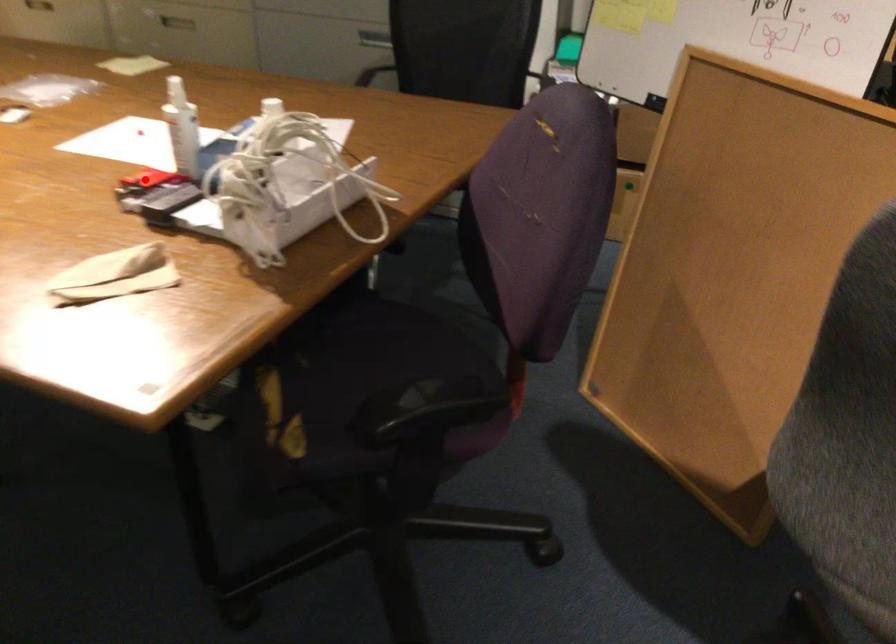
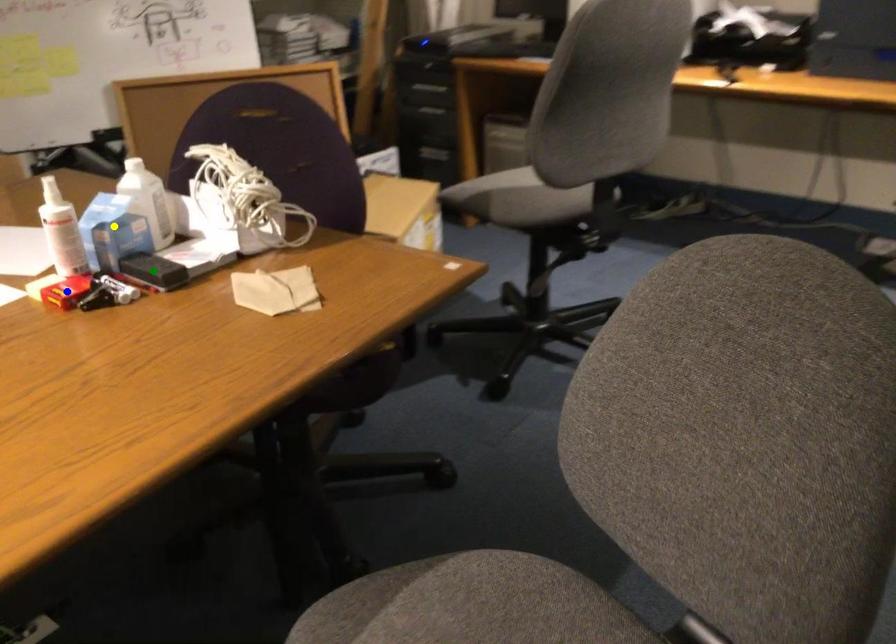
Question: I am providing you with two images of the same scene from different viewpoints. A red point is marked on the first image. You are given multiple points on the second image. In image 2, which mark is for the same physical point as the one in image 1?

Choices:
 (A) blue point
 (B) green point
 (C) yellow point

Answer: (A)